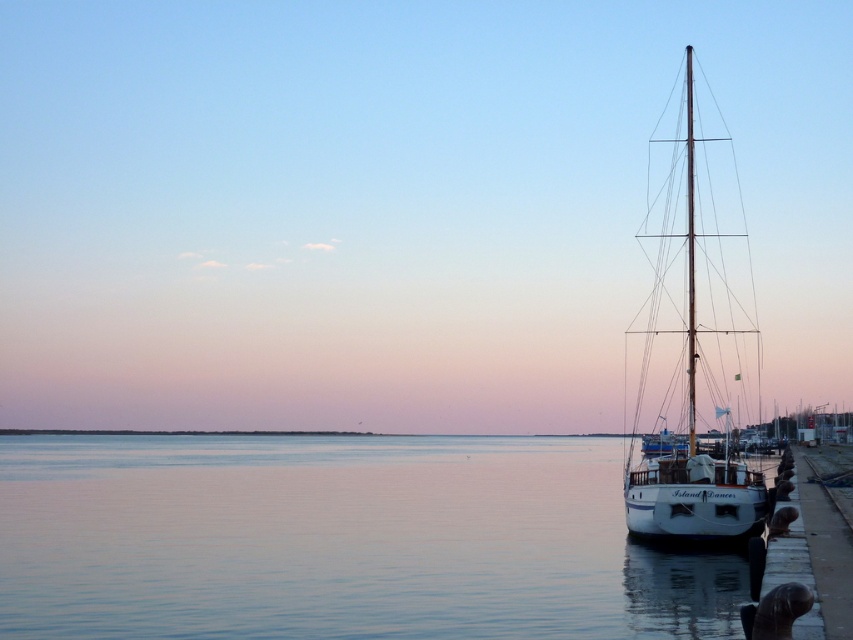
Question: Among these objects, which one is farthest from the camera?

Choices:
 (A) white polished wood sailboat at right
 (B) clear water at lower left

Answer: (A)

Question: Estimate the real-world distances between objects in this image. Which object is closer to the clear water at lower left?

Choices:
 (A) polished wood mast at right
 (B) white polished wood sailboat at right

Answer: (B)

Question: Which point appears farthest from the camera in this image?

Choices:
 (A) (694, 328)
 (B) (437, 518)

Answer: (B)

Question: Is clear water at lower left wider than white polished wood sailboat at right?

Choices:
 (A) no
 (B) yes

Answer: (B)

Question: Does white polished wood sailboat at right appear on the right side of polished wood mast at right?

Choices:
 (A) no
 (B) yes

Answer: (B)

Question: Does white polished wood sailboat at right appear on the right side of polished wood mast at right?

Choices:
 (A) no
 (B) yes

Answer: (B)